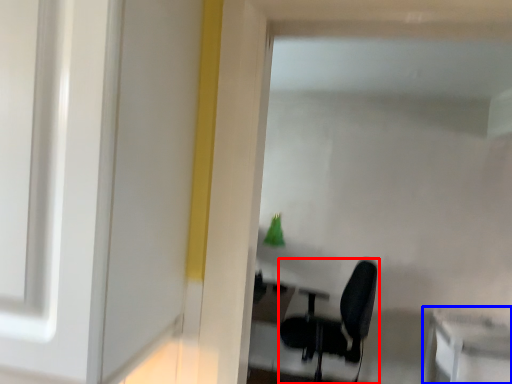
Question: Among these objects, which one is farthest to the camera, chair (highlighted by a red box) or table (highlighted by a blue box)?

Choices:
 (A) chair
 (B) table

Answer: (A)